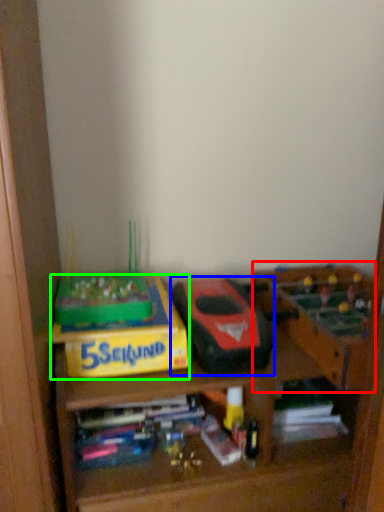
Question: Based on their relative distances, which object is nearer to toy (highlighted by a red box)? Choose from toy (highlighted by a blue box) and cardboard box (highlighted by a green box).

Choices:
 (A) toy
 (B) cardboard box

Answer: (A)